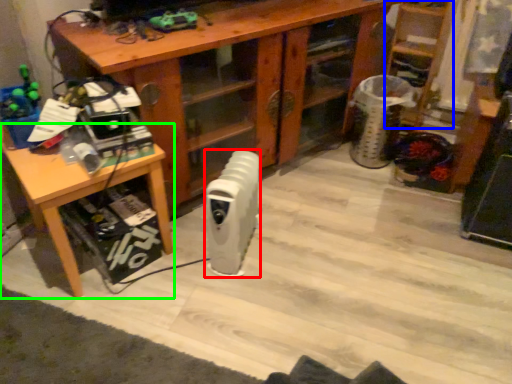
Question: Estimate the real-world distances between objects in this image. Which object is closer to radiator (highlighted by a red box), shelf (highlighted by a blue box) or table (highlighted by a green box)?

Choices:
 (A) shelf
 (B) table

Answer: (B)